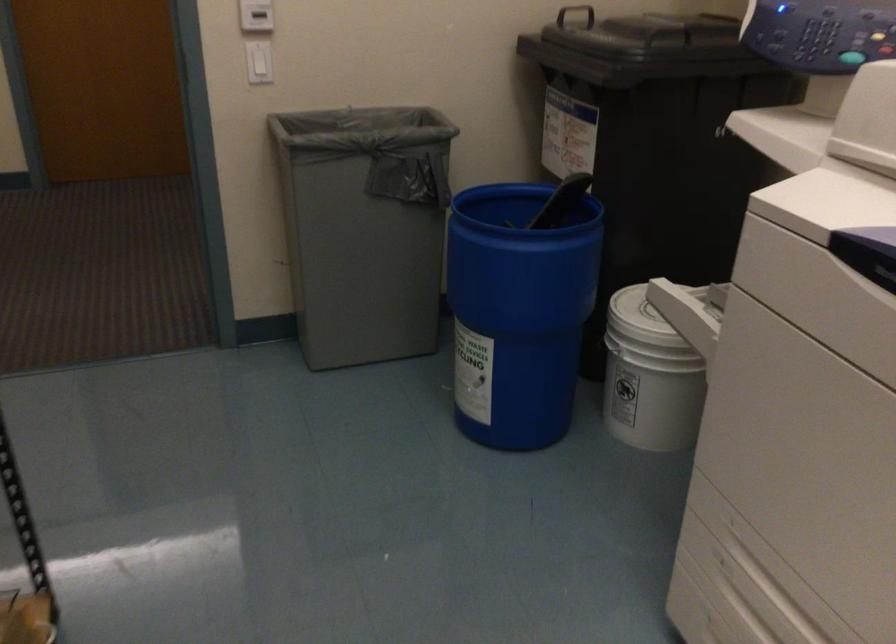
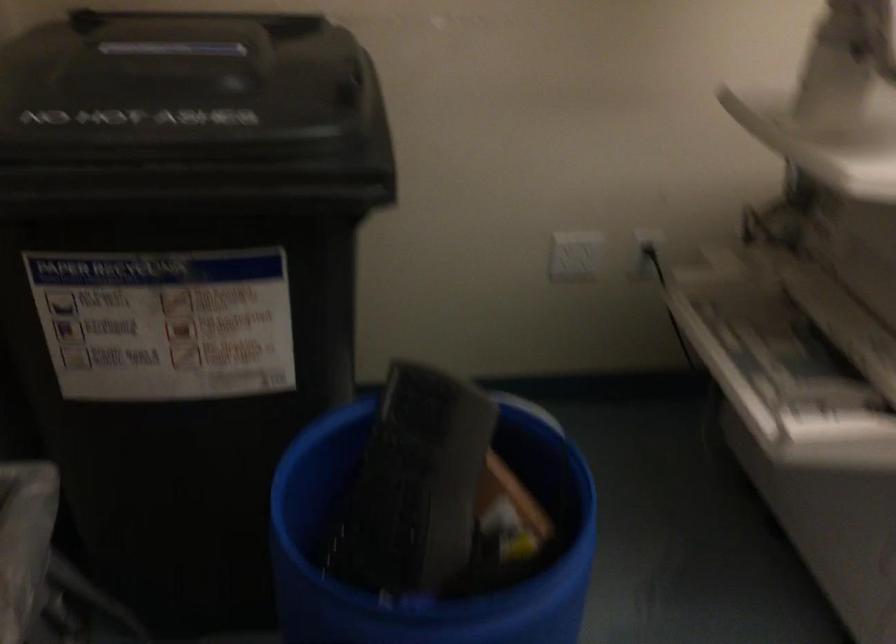
The point at (521, 232) is marked in the first image. Where is the corresponding point in the second image?

(427, 542)